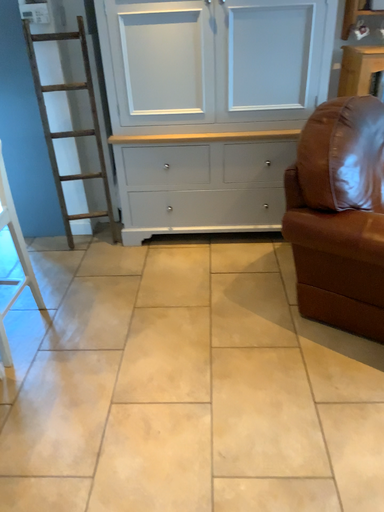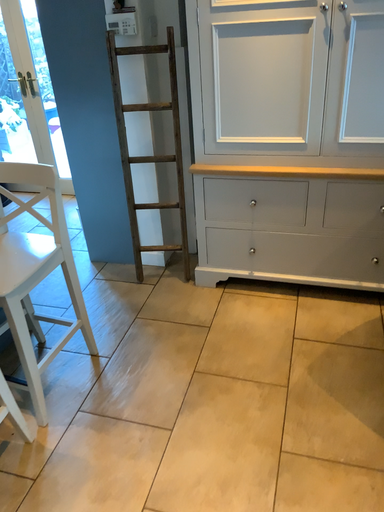
Question: How did the camera likely rotate when shooting the video?

Choices:
 (A) rotated left
 (B) rotated right

Answer: (A)